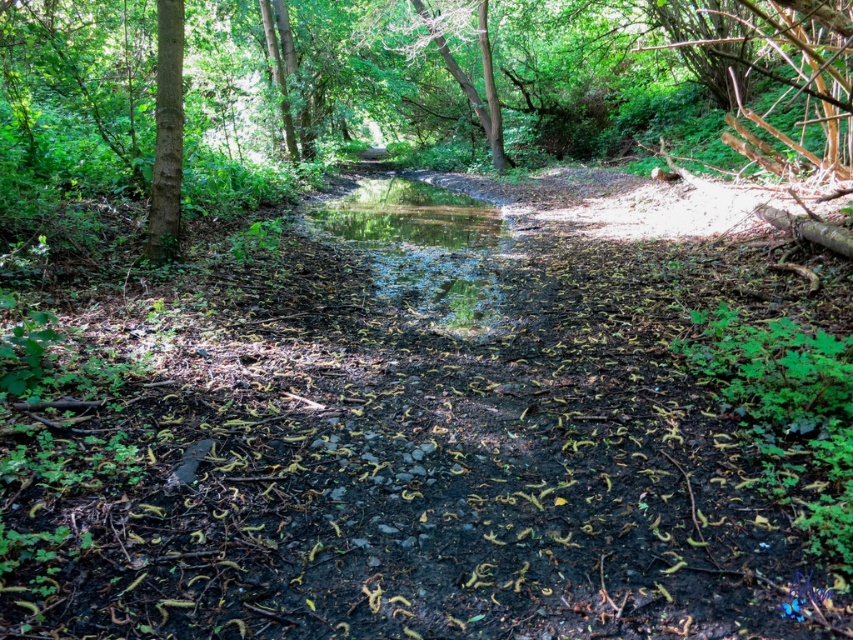
Who is more distant from viewer, (424,195) or (149,260)?

Positioned behind is point (424,195).

Does green reflective water at center have a larger size compared to smooth bark tree at left?

Yes.

Is point (463, 300) less distant than point (154, 246)?

Yes, it is.

Locate an element on the screen. The height and width of the screenshot is (640, 853). green reflective water at center is located at coordinates (421, 246).